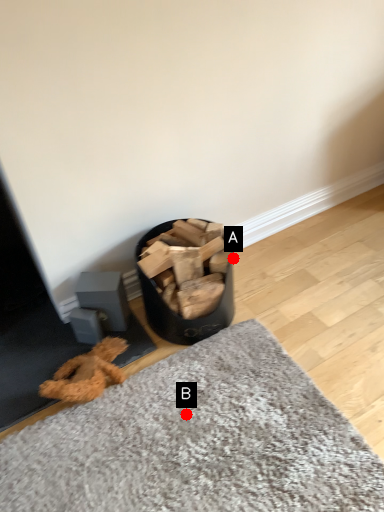
Question: Two points are circled on the image, labeled by A and B beside each circle. Which point is closer to the camera taking this photo?

Choices:
 (A) A is closer
 (B) B is closer

Answer: (B)